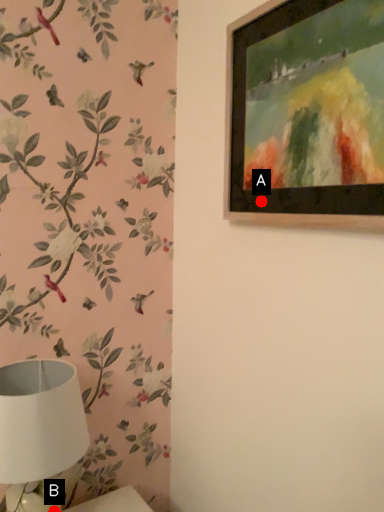
Question: Two points are circled on the image, labeled by A and B beside each circle. Among these points, which one is nearest to the camera?

Choices:
 (A) A is closer
 (B) B is closer

Answer: (A)